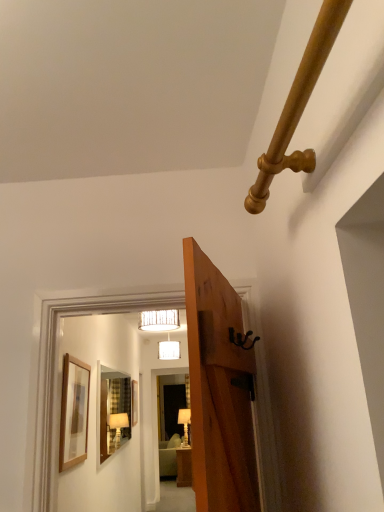
What is the approximate width of white fabric lampshade at upper center, the second lamp from the back?

14.88 inches.

Where is `wooden framed picture at left, which appears as the 1th picture frame when viewed from the top`? This screenshot has width=384, height=512. wooden framed picture at left, which appears as the 1th picture frame when viewed from the top is located at coordinates (74, 413).

Describe the element at coordinates (74, 413) in the screenshot. I see `wooden framed picture at left, the second picture frame in the back-to-front sequence` at that location.

The height and width of the screenshot is (512, 384). What do you see at coordinates (114, 411) in the screenshot? I see `clear glass mirror at center` at bounding box center [114, 411].

Where is `wooden door at center`? The height and width of the screenshot is (512, 384). wooden door at center is located at coordinates (218, 391).

Measure the distance between black matte door handle at upper right and camera.

They are 4.12 feet apart.

What do you see at coordinates (241, 339) in the screenshot? The height and width of the screenshot is (512, 384). I see `black matte door handle at upper right` at bounding box center [241, 339].

You are a GUI agent. You are given a task and a screenshot of the screen. Output one action in this format:
    pyautogui.click(x=<x>, y=<y>)
    Task: Click on the white glossy lamp at center, which ranks as the first lamp in back-to-front order
    
    Given the screenshot: What is the action you would take?
    pyautogui.click(x=185, y=423)

How many degrees apart are the facing directions of gold polished pipe at upper right and white fabric lampshade at upper center, which ranks as the second lamp in front-to-back order?

gold polished pipe at upper right and white fabric lampshade at upper center, which ranks as the second lamp in front-to-back order, are facing 88.9 degrees away from each other.

Which of these two, gold polished pipe at upper right or white fabric lampshade at upper center, the 2th lamp in the bottom-to-top sequence, is smaller?

Smaller between the two is gold polished pipe at upper right.

Does gold polished pipe at upper right have a greater height compared to white fabric lampshade at upper center, the second lamp from the top?

Incorrect, the height of gold polished pipe at upper right is not larger of that of white fabric lampshade at upper center, the second lamp from the top.

From the image's perspective, is gold polished pipe at upper right located above or below white fabric lampshade at upper center, the second lamp from the top?

Based on their image positions, gold polished pipe at upper right is located above white fabric lampshade at upper center, the second lamp from the top.

Is clear glass mirror at center taller than wooden framed picture at left, the 1th picture frame viewed from the right?

Yes, clear glass mirror at center is taller than wooden framed picture at left, the 1th picture frame viewed from the right.

What's the angular difference between clear glass mirror at center and wooden framed picture at left, the second picture frame in the back-to-front sequence,'s facing directions?

They differ by 0.0256 degrees in their facing directions.

Which object is positioned more to the right, clear glass mirror at center or wooden framed picture at left, the 1th picture frame viewed from the right?

wooden framed picture at left, the 1th picture frame viewed from the right, is more to the right.

From the image's perspective, is clear glass mirror at center located above or below wooden framed picture at left, the 1th picture frame viewed from the right?

From the image's perspective, clear glass mirror at center appears below wooden framed picture at left, the 1th picture frame viewed from the right.

Is point (61, 399) farther from viewer compared to point (185, 433)?

That is False.

Between wooden framed picture at left, which appears as the second picture frame when viewed from the left, and white glossy lamp at center, which ranks as the first lamp in back-to-front order, which one appears on the left side from the viewer's perspective?

From the viewer's perspective, wooden framed picture at left, which appears as the second picture frame when viewed from the left, appears more on the left side.

From the image's perspective, which one is positioned lower, wooden framed picture at left, the 2th picture frame when ordered from bottom to top, or white glossy lamp at center, which ranks as the first lamp in back-to-front order?

white glossy lamp at center, which ranks as the first lamp in back-to-front order.

In terms of height, does wooden framed picture at left, the 2th picture frame when ordered from bottom to top, look taller or shorter compared to white glossy lamp at center, which ranks as the first lamp in back-to-front order?

Considering their sizes, wooden framed picture at left, the 2th picture frame when ordered from bottom to top, has less height than white glossy lamp at center, which ranks as the first lamp in back-to-front order.

Who is more distant, matte white lampshade at upper center, marked as the 1th lamp in a front-to-back arrangement, or white glossy lamp at center, arranged as the 1th lamp when ordered from the bottom?

white glossy lamp at center, arranged as the 1th lamp when ordered from the bottom, is more distant.

Which of these two, matte white lampshade at upper center, which appears as the first lamp when viewed from the top, or white glossy lamp at center, which appears as the third lamp when viewed from the front, is smaller?

With smaller size is matte white lampshade at upper center, which appears as the first lamp when viewed from the top.

Considering the positions of objects matte white lampshade at upper center, the third lamp in the back-to-front sequence, and white glossy lamp at center, which appears as the third lamp when viewed from the front, in the image provided, who is more to the right, matte white lampshade at upper center, the third lamp in the back-to-front sequence, or white glossy lamp at center, which appears as the third lamp when viewed from the front,?

white glossy lamp at center, which appears as the third lamp when viewed from the front.

Could you tell me if matte white lampshade at upper center, which is counted as the third lamp, starting from the bottom, is turned towards white glossy lamp at center, which ranks as the third lamp in top-to-bottom order?

No, matte white lampshade at upper center, which is counted as the third lamp, starting from the bottom, is not turned towards white glossy lamp at center, which ranks as the third lamp in top-to-bottom order.

Could you measure the distance between wooden picture frame at center, positioned as the first picture frame in bottom-to-top order, and wooden framed picture at left, which appears as the second picture frame when viewed from the left?

2.11 meters.

Between wooden picture frame at center, positioned as the first picture frame in bottom-to-top order, and wooden framed picture at left, the second picture frame in the back-to-front sequence, which one appears on the right side from the viewer's perspective?

Positioned to the right is wooden framed picture at left, the second picture frame in the back-to-front sequence.

How different are the orientations of wooden picture frame at center, the 2th picture frame from the right, and wooden framed picture at left, which appears as the 1th picture frame when viewed from the top, in degrees?

0.027 degrees separate the facing orientations of wooden picture frame at center, the 2th picture frame from the right, and wooden framed picture at left, which appears as the 1th picture frame when viewed from the top.

From the image's perspective, which one is positioned higher, wooden picture frame at center, positioned as the first picture frame in bottom-to-top order, or wooden framed picture at left, which is the 1th picture frame from front to back?

wooden framed picture at left, which is the 1th picture frame from front to back, is shown above in the image.

Is wooden framed picture at left, the 1th picture frame viewed from the right, with gold polished pipe at upper right?

No, wooden framed picture at left, the 1th picture frame viewed from the right, is not touching gold polished pipe at upper right.

How many degrees apart are the facing directions of wooden framed picture at left, the second picture frame in the back-to-front sequence, and gold polished pipe at upper right?

180 degrees separate the facing orientations of wooden framed picture at left, the second picture frame in the back-to-front sequence, and gold polished pipe at upper right.

Would you say wooden framed picture at left, which appears as the second picture frame when viewed from the left, is outside gold polished pipe at upper right?

Yes, wooden framed picture at left, which appears as the second picture frame when viewed from the left, is outside of gold polished pipe at upper right.

In terms of width, does wooden framed picture at left, the 2th picture frame when ordered from bottom to top, look wider or thinner when compared to gold polished pipe at upper right?

Clearly, wooden framed picture at left, the 2th picture frame when ordered from bottom to top, has less width compared to gold polished pipe at upper right.

In the scene shown: Which of these two, black matte door handle at upper right or white glossy lamp at center, which ranks as the first lamp in back-to-front order, is wider?

white glossy lamp at center, which ranks as the first lamp in back-to-front order.

Which point is more forward, (240, 345) or (181, 411)?

The point (240, 345) is in front.

Based on their positions, is black matte door handle at upper right located to the left or right of white glossy lamp at center, arranged as the 1th lamp when ordered from the bottom?

black matte door handle at upper right is positioned on white glossy lamp at center, arranged as the 1th lamp when ordered from the bottom,'s right side.

From the image's perspective, is black matte door handle at upper right located beneath white glossy lamp at center, arranged as the 1th lamp when ordered from the bottom?

No, from the image's perspective, black matte door handle at upper right is not beneath white glossy lamp at center, arranged as the 1th lamp when ordered from the bottom.

From the image's perspective, starting from the gold polished pipe at upper right, which lamp is the 2nd one below? Please provide its 2D coordinates.

[(169, 350)]

Identify the location of picture frame located in front of the clear glass mirror at center. (74, 413).

In the scene shown: Considering their positions, is matte white lampshade at upper center, which is counted as the third lamp, starting from the bottom, positioned further to black matte door handle at upper right than clear glass mirror at center?

The object further to black matte door handle at upper right is matte white lampshade at upper center, which is counted as the third lamp, starting from the bottom.

From the image, which object appears to be farther from wooden door at center, white fabric lampshade at upper center, the 2th lamp in the bottom-to-top sequence, or matte white lampshade at upper center, marked as the 1th lamp in a front-to-back arrangement?

Based on the image, white fabric lampshade at upper center, the 2th lamp in the bottom-to-top sequence, appears to be further to wooden door at center.

Considering their positions, is white glossy lamp at center, which ranks as the third lamp in top-to-bottom order, positioned closer to matte white lampshade at upper center, which is counted as the third lamp, starting from the bottom, than clear glass mirror at center?

white glossy lamp at center, which ranks as the third lamp in top-to-bottom order, is positioned closer to the anchor matte white lampshade at upper center, which is counted as the third lamp, starting from the bottom.

From the image, which object appears to be farther from white fabric lampshade at upper center, the second lamp from the top, white glossy lamp at center, which ranks as the third lamp in top-to-bottom order, or gold polished pipe at upper right?

gold polished pipe at upper right lies further to white fabric lampshade at upper center, the second lamp from the top, than the other object.

Considering their positions, is black matte door handle at upper right positioned closer to matte white lampshade at upper center, which is counted as the third lamp, starting from the bottom, than wooden picture frame at center, the 2th picture frame when ordered from front to back?

wooden picture frame at center, the 2th picture frame when ordered from front to back, is closer to matte white lampshade at upper center, which is counted as the third lamp, starting from the bottom.

Estimate the real-world distances between objects in this image. Which object is closer to clear glass mirror at center, gold polished pipe at upper right or wooden picture frame at center, the first picture frame in the back-to-front sequence?

wooden picture frame at center, the first picture frame in the back-to-front sequence, is positioned closer to the anchor clear glass mirror at center.

Based on their spatial positions, is wooden framed picture at left, which is the 1th picture frame from front to back, or white fabric lampshade at upper center, which ranks as the second lamp in front-to-back order, closer to gold polished pipe at upper right?

wooden framed picture at left, which is the 1th picture frame from front to back, is positioned closer to the anchor gold polished pipe at upper right.

Which object lies nearer to the anchor point wooden framed picture at left, the second picture frame in the back-to-front sequence, white glossy lamp at center, arranged as the 1th lamp when ordered from the bottom, or wooden picture frame at center, the 2th picture frame from the right?

The object closer to wooden framed picture at left, the second picture frame in the back-to-front sequence, is wooden picture frame at center, the 2th picture frame from the right.

This screenshot has height=512, width=384. I want to click on mirror located between wooden door at center and white fabric lampshade at upper center, the second lamp from the back, in the depth direction, so click(x=114, y=411).

Find the location of `lamp between wooden framed picture at left, the 1th picture frame viewed from the right, and wooden picture frame at center, the 1th picture frame when ordered from left to right, along the z-axis`. lamp between wooden framed picture at left, the 1th picture frame viewed from the right, and wooden picture frame at center, the 1th picture frame when ordered from left to right, along the z-axis is located at coordinates (159, 320).

I want to click on door between gold polished pipe at upper right and matte white lampshade at upper center, which is counted as the third lamp, starting from the bottom, from front to back, so click(x=218, y=391).

Where is `lamp between black matte door handle at upper right and white fabric lampshade at upper center, the second lamp from the back, along the z-axis`? This screenshot has height=512, width=384. lamp between black matte door handle at upper right and white fabric lampshade at upper center, the second lamp from the back, along the z-axis is located at coordinates (159, 320).